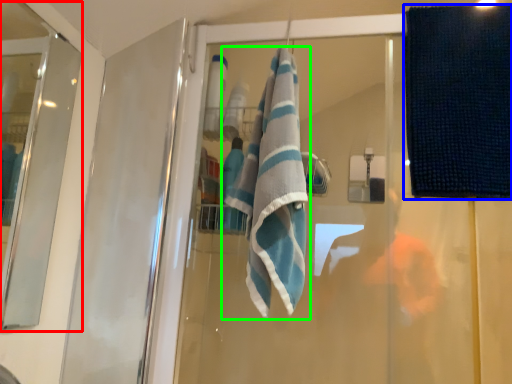
Question: Which object is the farthest from screen door (highlighted by a red box)? Choose among these: beach towel (highlighted by a blue box) or towel (highlighted by a green box).

Choices:
 (A) beach towel
 (B) towel

Answer: (A)